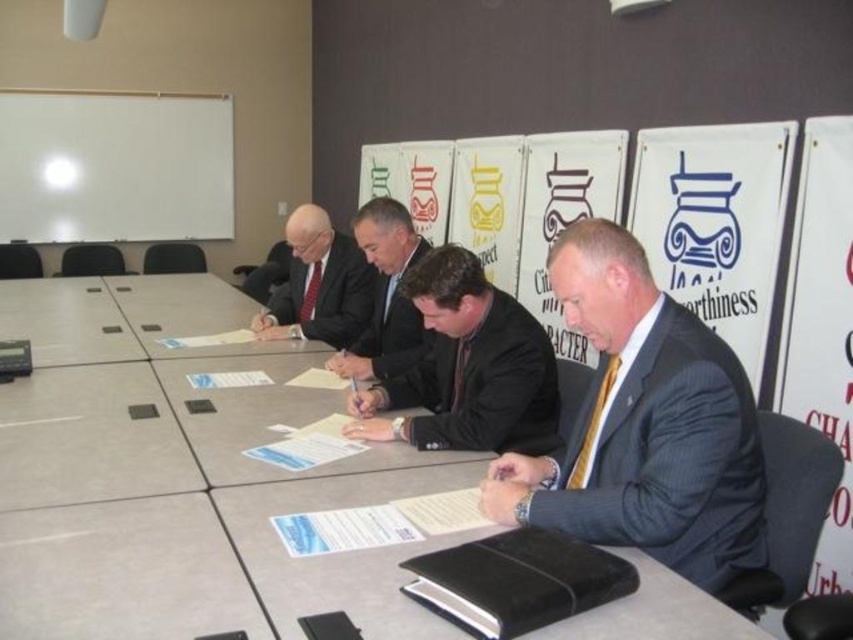
Is point (292, 246) in front of point (424, 250)?

No, it is not.

Is point (300, 227) positioned before point (387, 323)?

No, it is behind (387, 323).

You are a GUI agent. You are given a task and a screenshot of the screen. Output one action in this format:
    pyautogui.click(x=<x>, y=<y>)
    Task: Click on the matte black suit at center
    
    Given the screenshot: What is the action you would take?
    pyautogui.click(x=318, y=284)

Can you confirm if white matte board at upper left is bigger than dark suit at center?

Indeed, white matte board at upper left has a larger size compared to dark suit at center.

In the scene shown: Is white matte board at upper left further to the viewer compared to dark suit at center?

Yes.

Does point (24, 182) come closer to viewer compared to point (553, 385)?

No, it is behind (553, 385).

Locate an element on the screen. This screenshot has width=853, height=640. white matte board at upper left is located at coordinates (114, 168).

Can you confirm if dark suit at center is taller than matte black suit at center?

Incorrect, dark suit at center's height is not larger of matte black suit at center's.

Who is shorter, dark suit at center or matte black suit at center?

dark suit at center

Which is behind, point (402, 392) or point (293, 259)?

Point (293, 259)

This screenshot has width=853, height=640. I want to click on dark suit at center, so click(x=467, y=368).